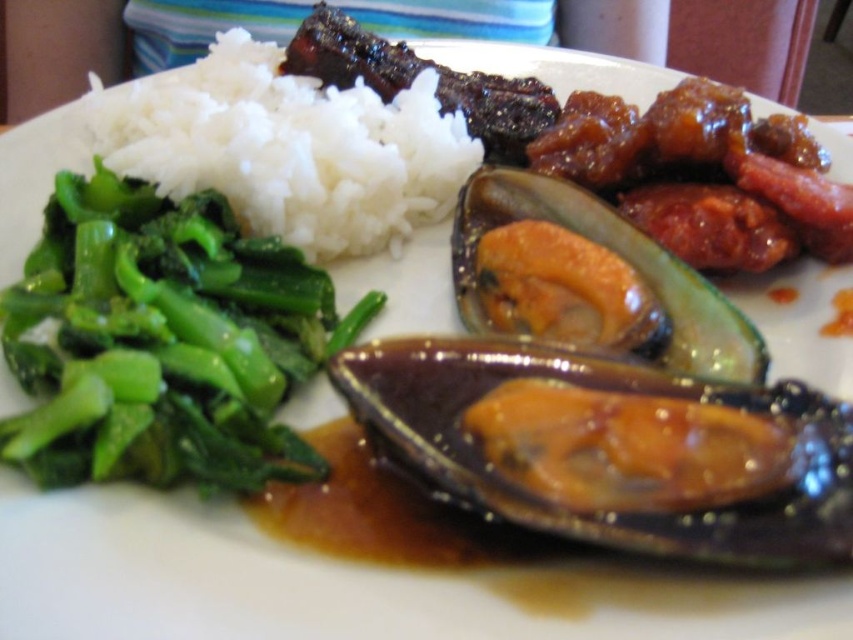
Question: Which of the following is the farthest from the observer?

Choices:
 (A) white matte rice at upper left
 (B) green smooth/soft broccoli at left
 (C) shiny orange shell at center
 (D) shiny brown oyster at center

Answer: (A)

Question: Is shiny brown oyster at center smaller than green smooth/soft broccoli at left?

Choices:
 (A) yes
 (B) no

Answer: (A)

Question: Is green smooth/soft broccoli at left to the left of white matte rice at upper left from the viewer's perspective?

Choices:
 (A) yes
 (B) no

Answer: (B)

Question: Among these objects, which one is nearest to the camera?

Choices:
 (A) white matte rice at upper left
 (B) green smooth/soft broccoli at left
 (C) shiny orange shell at center
 (D) shiny brown oyster at center

Answer: (D)

Question: Is white matte rice at upper left smaller than shiny orange shell at center?

Choices:
 (A) no
 (B) yes

Answer: (A)

Question: Which object appears farthest from the camera in this image?

Choices:
 (A) shiny orange shell at center
 (B) green smooth/soft broccoli at left
 (C) shiny brown oyster at center

Answer: (A)